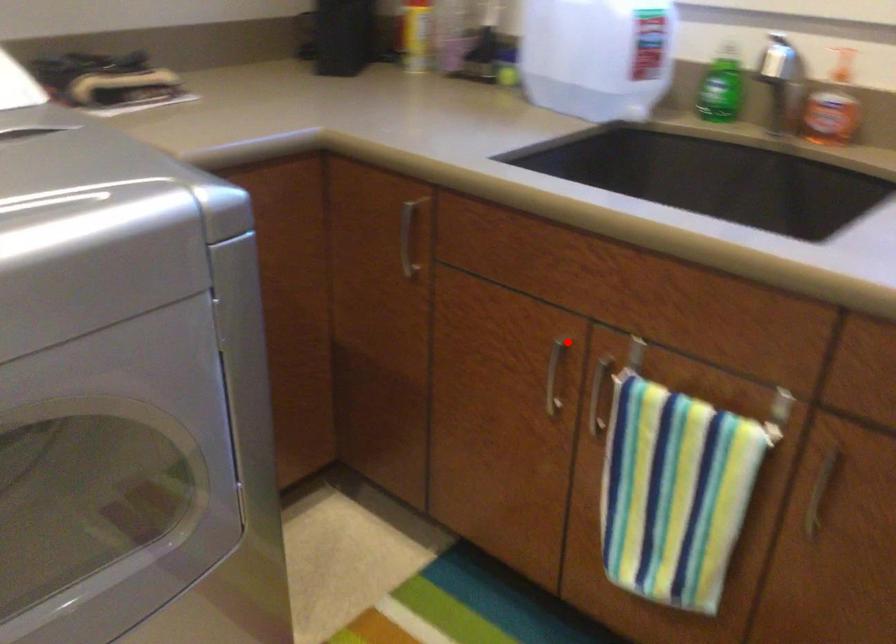
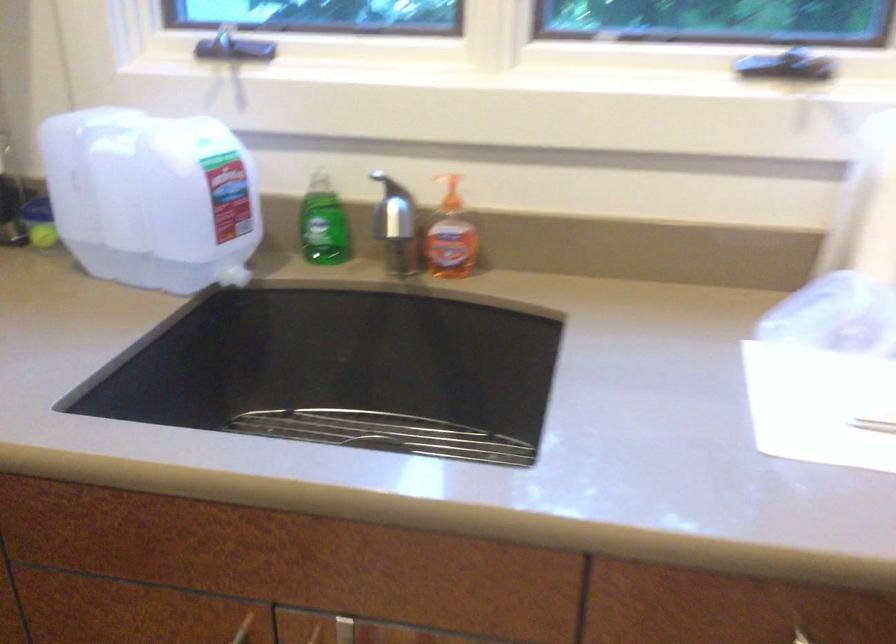
Question: I am providing you with two images of the same scene from different viewpoints. A red point is shown in image1. For the corresponding object point in image2, is it positioned nearer or farther from the camera?

Choices:
 (A) Nearer
 (B) Farther

Answer: (A)